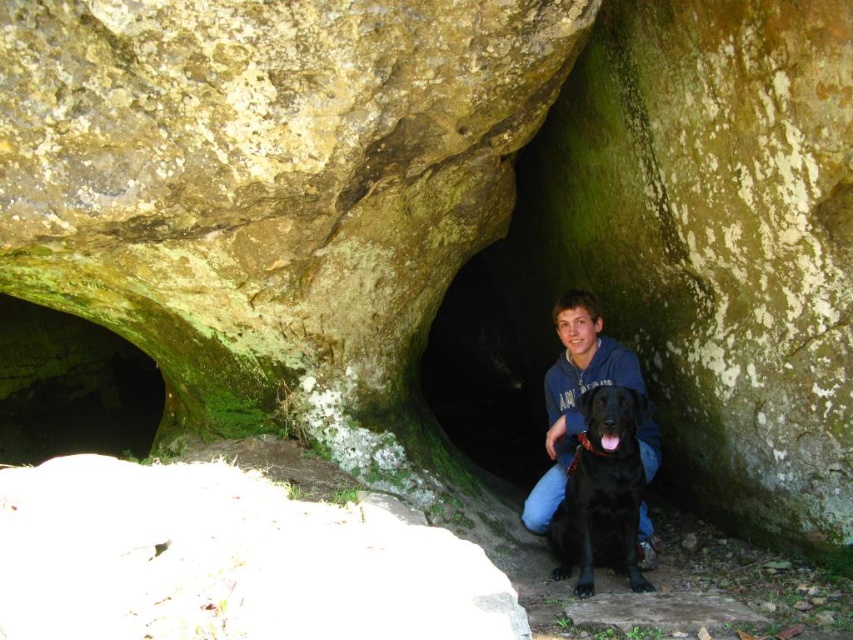
Question: Can you confirm if green mossy cave at upper left is smaller than blue fleece jacket at center?

Choices:
 (A) yes
 (B) no

Answer: (B)

Question: Does green mossy cave at upper left have a smaller size compared to blue fleece jacket at center?

Choices:
 (A) yes
 (B) no

Answer: (B)

Question: Which point is farther from the camera taking this photo?

Choices:
 (A) (32, 378)
 (B) (543, 477)
 (C) (608, 387)

Answer: (A)

Question: Is green mossy cave at upper left to the left of blue fleece jacket at center from the viewer's perspective?

Choices:
 (A) yes
 (B) no

Answer: (A)

Question: Which point is farther to the camera?

Choices:
 (A) blue fleece jacket at center
 (B) shiny black dog at center

Answer: (A)

Question: Among these objects, which one is farthest from the camera?

Choices:
 (A) blue fleece jacket at center
 (B) shiny black dog at center

Answer: (A)